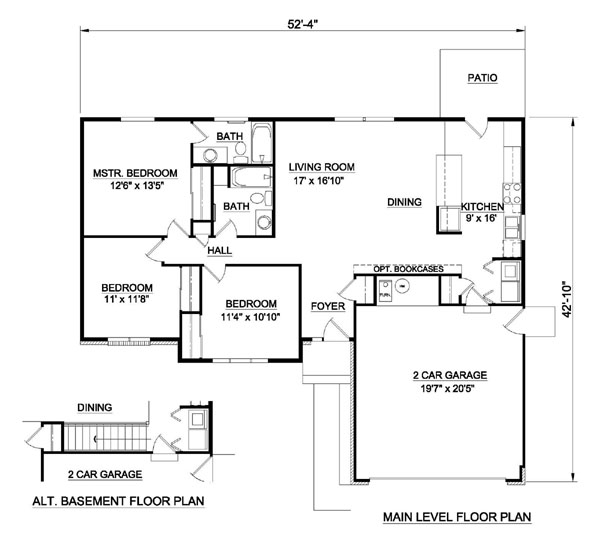
The image size is (600, 544). Identify the location of dining area. (107, 408).